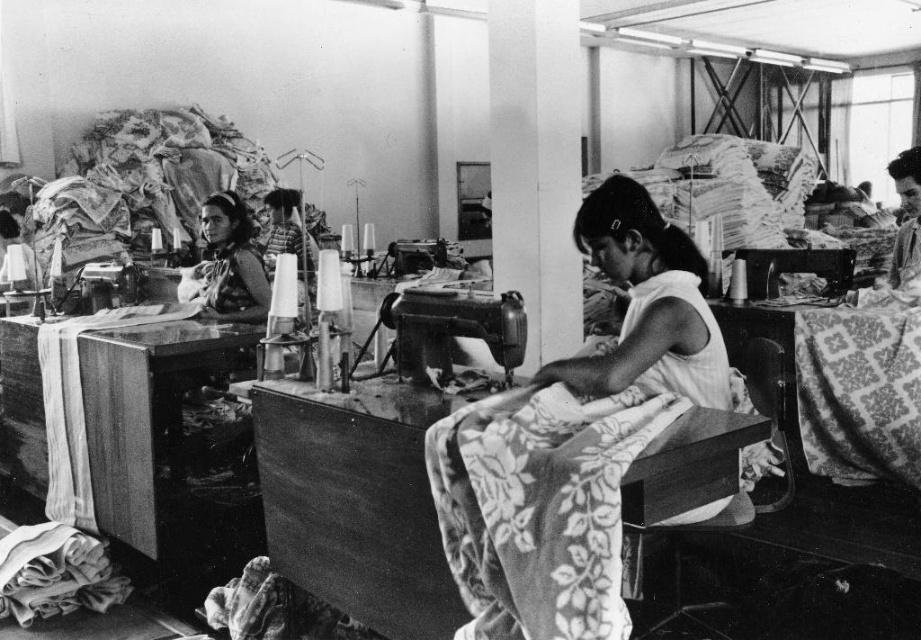
Is white fabric at center wider than patterned fabric at center?

Indeed, white fabric at center has a greater width compared to patterned fabric at center.

Who is more distant from viewer, [556,612] or [828,337]?

The point [828,337] is behind.

Which is behind, point (686, 314) or point (826, 406)?

Point (826, 406)

In order to click on white fabric at center in this screenshot , I will do `click(575, 440)`.

Does patterned fabric at center appear on the right side of soft cotton fabric at lower left?

Yes, patterned fabric at center is to the right of soft cotton fabric at lower left.

The height and width of the screenshot is (640, 921). What are the coordinates of `patterned fabric at center` in the screenshot? It's located at (859, 392).

This screenshot has height=640, width=921. What are the coordinates of `patterned fabric at center` in the screenshot? It's located at (859, 392).

Where is `patterned fabric at center`? Image resolution: width=921 pixels, height=640 pixels. patterned fabric at center is located at coordinates (859, 392).

Does floral-patterned fabric at center have a lesser width compared to matte fabric headscarf at center?

Correct, floral-patterned fabric at center's width is less than matte fabric headscarf at center's.

Is the position of floral-patterned fabric at center less distant than that of matte fabric headscarf at center?

Yes.

Is point (511, 625) behind point (220, 244)?

No, it is in front of (220, 244).

The width and height of the screenshot is (921, 640). I want to click on floral-patterned fabric at center, so click(540, 506).